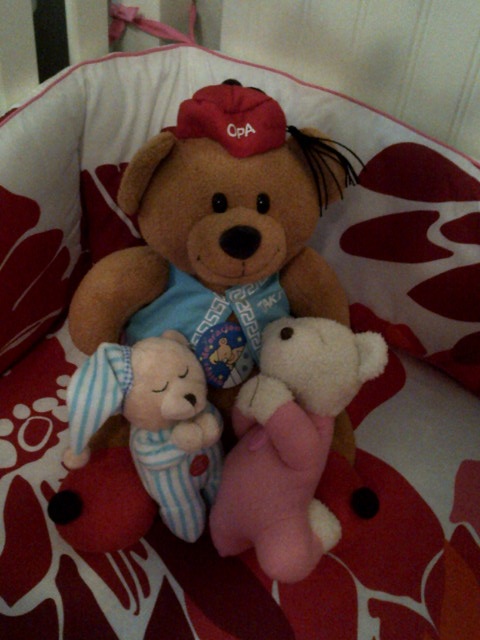
The image size is (480, 640). In order to click on white teddy bear in this screenshot , I will do `click(303, 360)`.